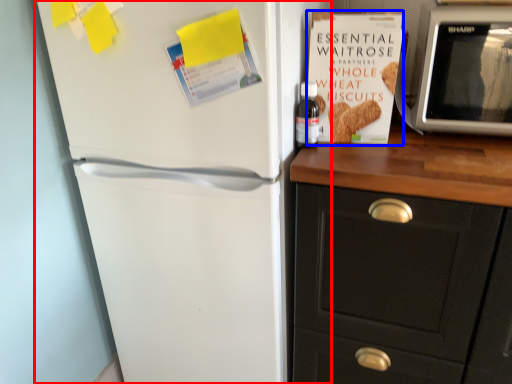
Question: Among these objects, which one is farthest to the camera, refrigerator (highlighted by a red box) or paperback book (highlighted by a blue box)?

Choices:
 (A) refrigerator
 (B) paperback book

Answer: (B)